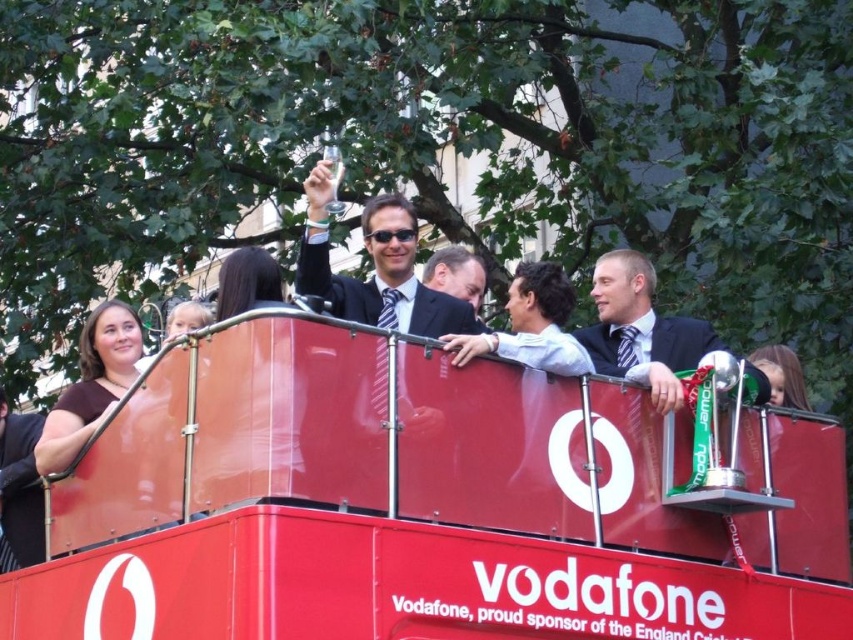
You are standing on the street next to the shiny red bus at center and the smooth black suit at center. Which object is positioned to the left?

The smooth black suit at center is to the left of the shiny red bus at center.